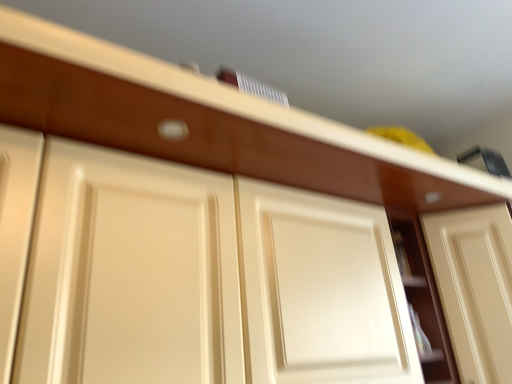
Question: Is matte cream drawer at center positioned far away from matte cream cabinet at center?

Choices:
 (A) no
 (B) yes

Answer: (A)

Question: From a real-world perspective, is matte cream drawer at center physically above matte cream cabinet at center?

Choices:
 (A) no
 (B) yes

Answer: (B)

Question: Is matte cream drawer at center smaller than matte cream cabinet at center?

Choices:
 (A) yes
 (B) no

Answer: (B)

Question: Does matte cream drawer at center turn towards matte cream cabinet at center?

Choices:
 (A) no
 (B) yes

Answer: (A)

Question: From the image's perspective, is matte cream drawer at center below matte cream cabinet at center?

Choices:
 (A) yes
 (B) no

Answer: (B)

Question: Considering the relative positions of matte cream door at center, which is the second door from left to right, and matte cream drawer at center in the image provided, is matte cream door at center, which is the second door from left to right, to the left or to the right of matte cream drawer at center?

Choices:
 (A) left
 (B) right

Answer: (B)

Question: Is matte cream door at center, acting as the 1th door starting from the right, situated inside matte cream drawer at center or outside?

Choices:
 (A) outside
 (B) inside

Answer: (A)

Question: From the image's perspective, is matte cream door at center, acting as the 1th door starting from the right, located above or below matte cream drawer at center?

Choices:
 (A) above
 (B) below

Answer: (B)

Question: From their relative heights in the image, would you say matte cream door at center, which is the second door from left to right, is taller or shorter than matte cream drawer at center?

Choices:
 (A) tall
 (B) short

Answer: (A)

Question: In the image, is matte cream cabinet door at center, which ranks as the second door in right-to-left order, positioned in front of or behind matte white door handle at upper center?

Choices:
 (A) front
 (B) behind

Answer: (A)

Question: Is point (142, 314) positioned closer to the camera than point (178, 135)?

Choices:
 (A) farther
 (B) closer

Answer: (B)

Question: Based on their sizes in the image, would you say matte cream cabinet door at center, marked as the first door in a left-to-right arrangement, is bigger or smaller than matte white door handle at upper center?

Choices:
 (A) big
 (B) small

Answer: (A)

Question: From a real-world perspective, relative to matte white door handle at upper center, is matte cream cabinet door at center, which ranks as the second door in right-to-left order, vertically above or below?

Choices:
 (A) below
 (B) above

Answer: (A)

Question: Based on their sizes in the image, would you say matte cream door at center, acting as the 1th door starting from the right, is bigger or smaller than matte cream cabinet at center?

Choices:
 (A) small
 (B) big

Answer: (B)

Question: From the image's perspective, is matte cream door at center, acting as the 1th door starting from the right, located above or below matte cream cabinet at center?

Choices:
 (A) below
 (B) above

Answer: (A)